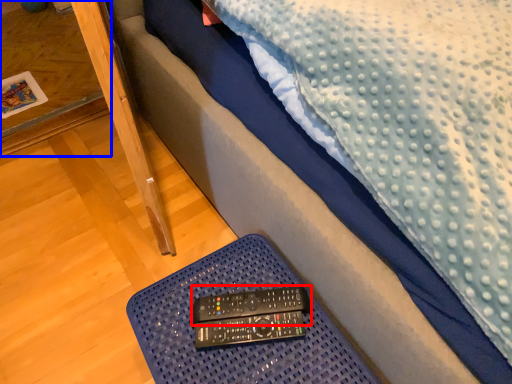
Question: Which object is further to the camera taking this photo, control (highlighted by a red box) or table (highlighted by a blue box)?

Choices:
 (A) control
 (B) table

Answer: (B)